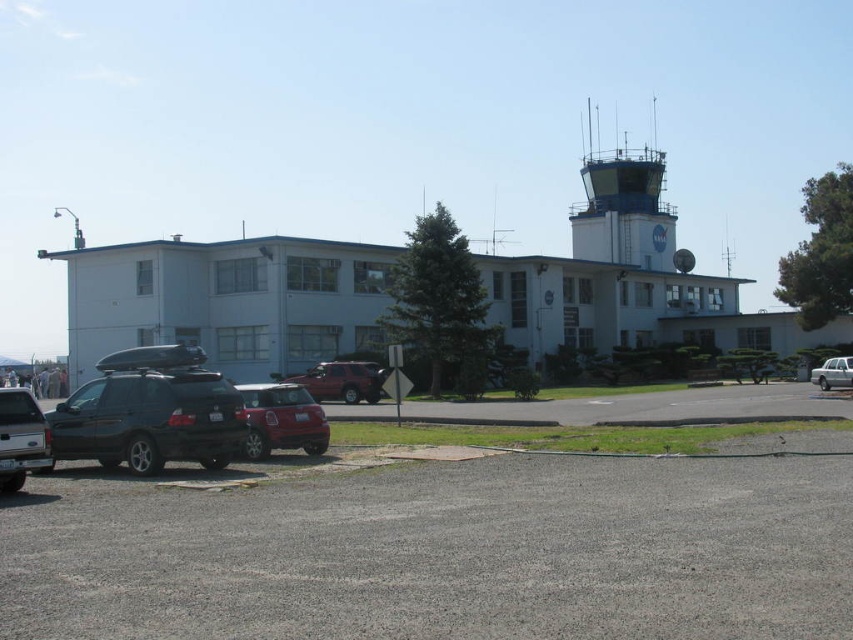
You are a photographer standing at the edge of the airfield. You need to capture a photo that includes both the matte black truck at lower left and the shiny red suv at center. Which vehicle should you position closer to the camera to ensure both are fully visible in the frame?

The matte black truck at lower left is shorter than the shiny red suv at center. To ensure both are fully visible in the frame, position the matte black truck at lower left closer to the camera so it appears larger relative to the shiny red suv at center.

You are standing at the entrance of the airport and want to walk towards the white metallic sedan at lower right. However, you notice the smooth gray control tower at upper right blocking your path. Can you walk around the control tower to reach the sedan?

The smooth gray control tower at upper right is further to the viewer than the white metallic sedan at lower right, so it is actually closer to you. This means the control tower is between you and the sedan, making it impossible to walk around it without going past it first.